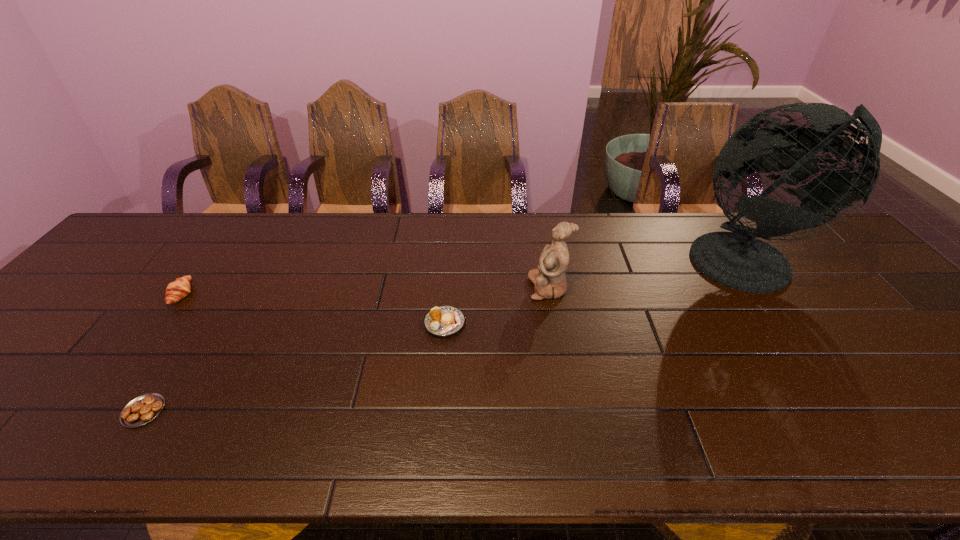
At what (x,y) coordinates should I click in order to perform the action: click on vacant area situated on the front-facing side of the tallest object. Please return your answer as a coordinate pair (x, y). The image size is (960, 540). Looking at the image, I should click on (823, 359).

The image size is (960, 540). What are the coordinates of `free spot located 0.050m on the front-facing side of the figurine` in the screenshot? It's located at (511, 288).

Identify the location of free region located on the front-facing side of the figurine. The height and width of the screenshot is (540, 960). (507, 288).

Identify the location of vacant space located 0.250m on the front-facing side of the figurine. The height and width of the screenshot is (540, 960). (438, 288).

The image size is (960, 540). Identify the location of free space located on the front-facing side of the leftmost pastry. (240, 295).

Where is `free location located 0.210m on the right of the fourth tallest object`? The width and height of the screenshot is (960, 540). free location located 0.210m on the right of the fourth tallest object is located at coordinates (549, 323).

You are a GUI agent. You are given a task and a screenshot of the screen. Output one action in this format:
    pyautogui.click(x=<x>, y=<y>)
    Task: Click on the vacant space located 0.360m on the right of the second object from left to right
    
    Given the screenshot: What is the action you would take?
    click(334, 411)

Where is `object situated at the far edge`? object situated at the far edge is located at coordinates (737, 260).

Find the location of `object that is at the near edge`. object that is at the near edge is located at coordinates (143, 409).

At what (x,y) coordinates should I click in order to perform the action: click on object positioned at the right edge. Please return your answer as a coordinate pair (x, y). The height and width of the screenshot is (540, 960). Looking at the image, I should click on (737, 260).